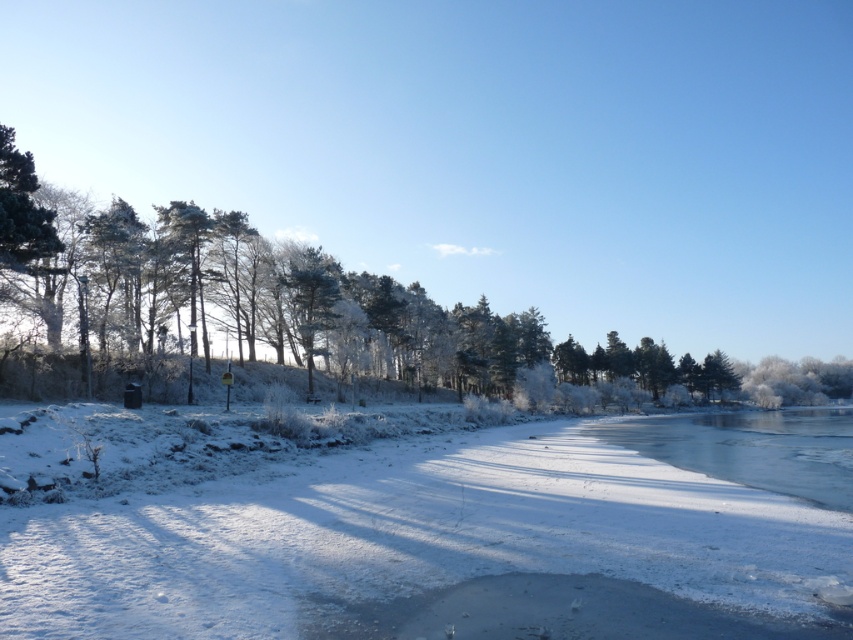
Question: Which object is positioned closest to the glossy snow-covered tree at center?

Choices:
 (A) clear ice water at lower right
 (B) white frosty snow at center

Answer: (A)

Question: Is clear ice water at lower right bigger than glossy snow-covered tree at center?

Choices:
 (A) no
 (B) yes

Answer: (B)

Question: Among these objects, which one is nearest to the camera?

Choices:
 (A) glossy snow-covered tree at center
 (B) white frosty snow at center
 (C) clear ice water at lower right

Answer: (B)

Question: Does white frosty snow at center have a greater width compared to glossy snow-covered tree at center?

Choices:
 (A) yes
 (B) no

Answer: (A)

Question: Which is nearer to the white frosty snow at center?

Choices:
 (A) clear ice water at lower right
 (B) glossy snow-covered tree at center

Answer: (A)

Question: Does clear ice water at lower right lie behind glossy snow-covered tree at center?

Choices:
 (A) no
 (B) yes

Answer: (A)